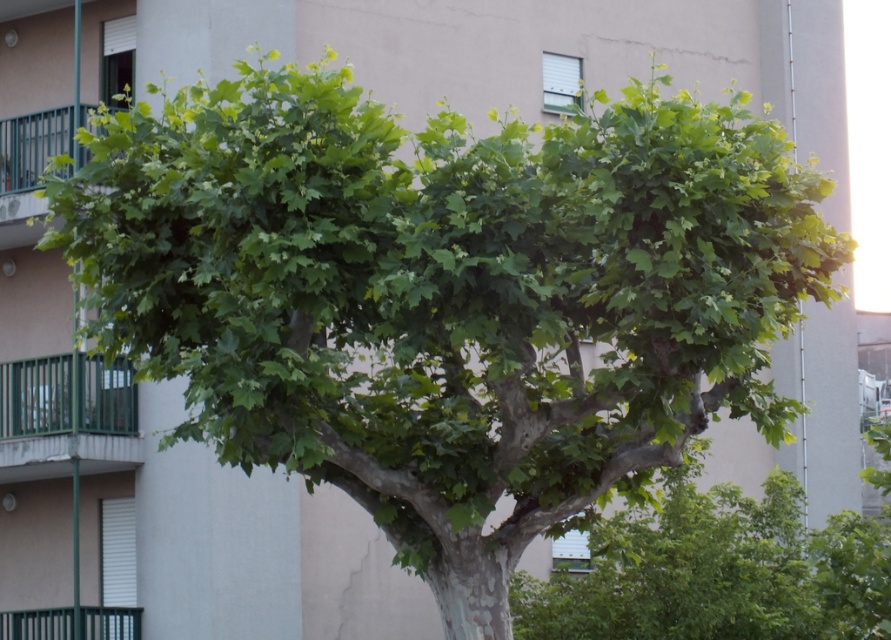
You are a painter hired to paint all the green metal railings in the scene. You have a limited amount of paint. Which railing, the green metal railing at lower left or the green metal railing at upper left, will require more paint based on their widths?

The green metal railing at lower left requires more paint because its width is greater than the green metal railing at upper left, as stated in the description.

You are standing in front of a tree and looking towards a building with two green metal railings. The railings are both labeled as green metal railing at lower left and green metal railing at upper left. Which of these railings is taller?

The green metal railing at lower left is taller than the green metal railing at upper left.